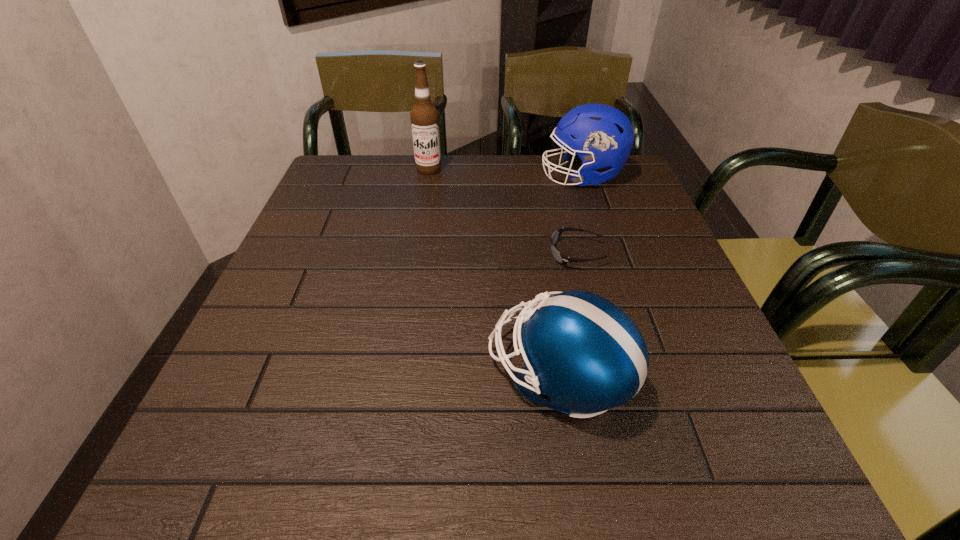
At what (x,y) coordinates should I click in order to perform the action: click on object that is at the far right corner. Please return your answer as a coordinate pair (x, y). The height and width of the screenshot is (540, 960). Looking at the image, I should click on (603, 136).

Where is `free space at the far edge`? free space at the far edge is located at coordinates (526, 192).

You are a GUI agent. You are given a task and a screenshot of the screen. Output one action in this format:
    pyautogui.click(x=<x>, y=<y>)
    Task: Click on the vacant space at the near edge of the desktop
    The width and height of the screenshot is (960, 540).
    Given the screenshot: What is the action you would take?
    pyautogui.click(x=607, y=502)

Image resolution: width=960 pixels, height=540 pixels. I want to click on free space at the left edge of the desktop, so click(x=292, y=410).

The height and width of the screenshot is (540, 960). I want to click on free space at the right edge of the desktop, so click(x=657, y=220).

I want to click on vacant space at the far left corner, so click(x=353, y=200).

Find the location of `vacant position at the near left corner of the desktop`. vacant position at the near left corner of the desktop is located at coordinates (230, 484).

Where is `free space between the farther football helmet and the nearer football helmet`? This screenshot has width=960, height=540. free space between the farther football helmet and the nearer football helmet is located at coordinates (570, 276).

At what (x,y) coordinates should I click in order to perform the action: click on free space between the leftmost object and the farther football helmet. Please return your answer as a coordinate pair (x, y). Looking at the image, I should click on (505, 173).

Find the location of `free space between the farther football helmet and the nearer football helmet`. free space between the farther football helmet and the nearer football helmet is located at coordinates (570, 276).